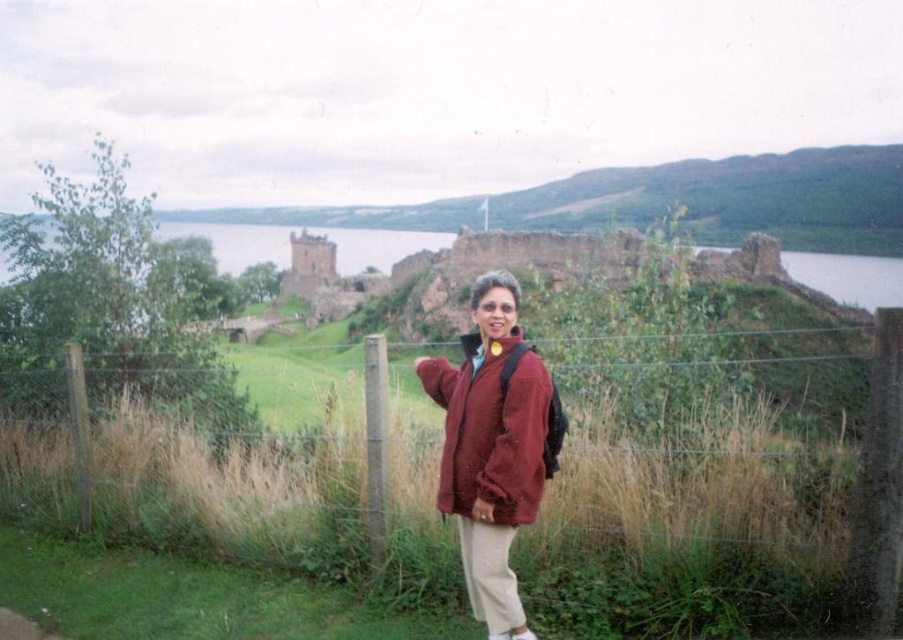
From the picture: Who is shorter, wire mesh fence at center or matte red jacket at center?

matte red jacket at center is shorter.

Is wire mesh fence at center above matte red jacket at center?

Actually, wire mesh fence at center is below matte red jacket at center.

Who is more forward, (813, 563) or (537, 454)?

Point (813, 563)

At what (x,y) coordinates should I click in order to perform the action: click on wire mesh fence at center. Please return your answer as a coordinate pair (x, y). The image size is (903, 640). Looking at the image, I should click on (644, 516).

This screenshot has width=903, height=640. I want to click on matte red jacket at center, so tap(492, 428).

The height and width of the screenshot is (640, 903). Identify the location of matte red jacket at center. (492, 428).

Does wire mesh fence at center appear on the right side of stone brick castle at center?

Yes, wire mesh fence at center is to the right of stone brick castle at center.

Between wire mesh fence at center and stone brick castle at center, which one appears on the left side from the viewer's perspective?

Positioned to the left is stone brick castle at center.

I want to click on wire mesh fence at center, so click(644, 516).